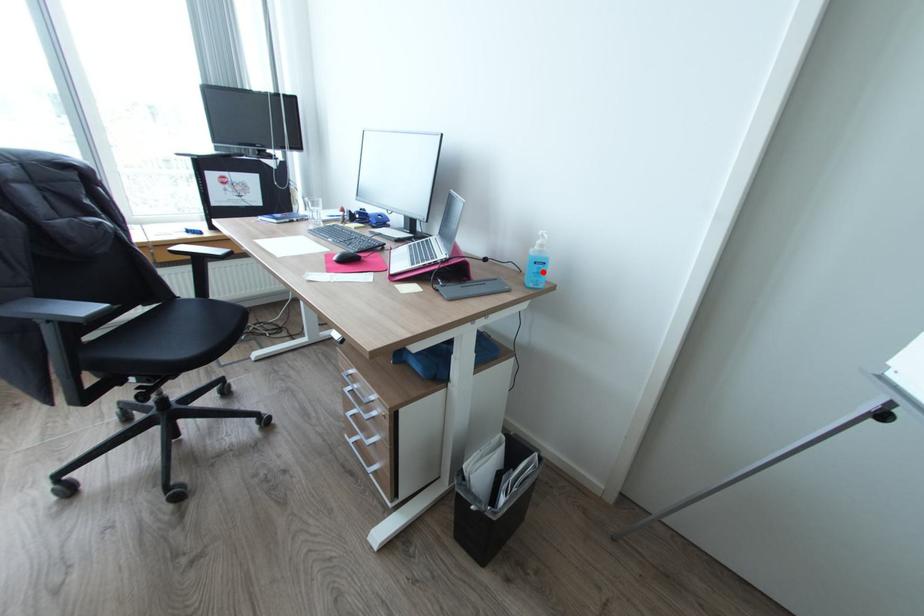
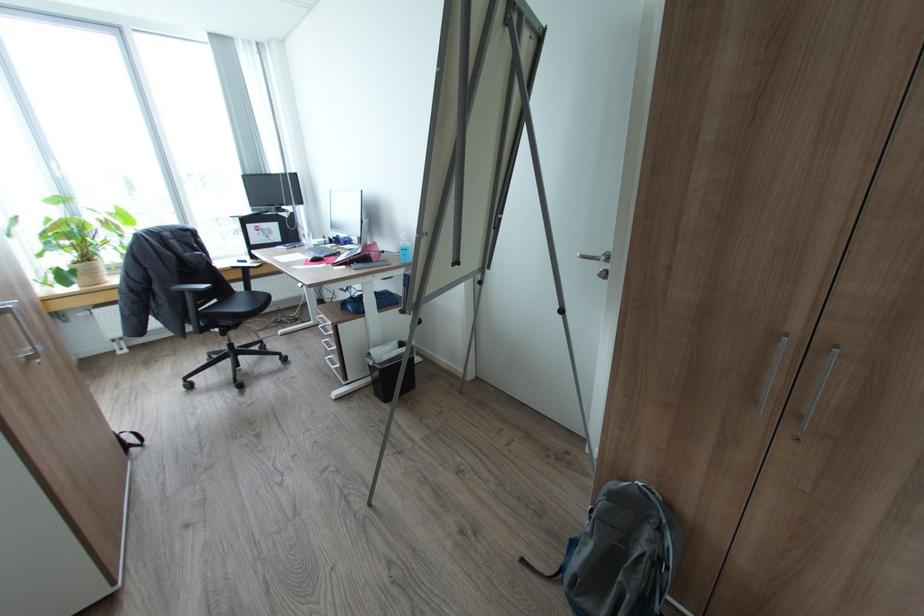
In the second image, find the point that corresponds to the highlighted location in the first image.

(408, 254)